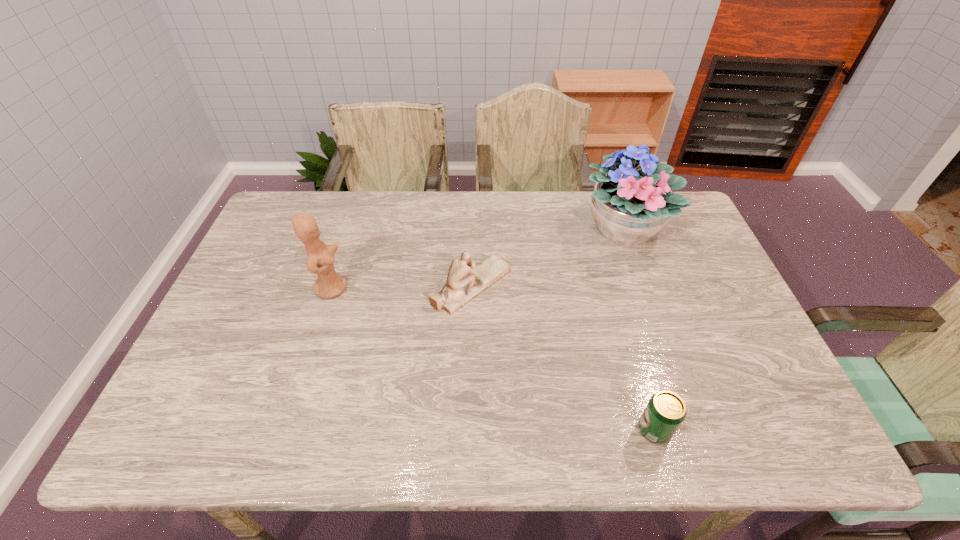
This screenshot has width=960, height=540. In order to click on bouquet in this screenshot , I will do `click(630, 206)`.

Identify the location of the leftmost object. (320, 260).

Identify the location of the left figurine. (320, 260).

Locate an element on the screen. the right figurine is located at coordinates (465, 281).

The width and height of the screenshot is (960, 540). Identify the location of the shorter figurine. (465, 281).

At what (x,y) coordinates should I click in order to perform the action: click on beer can. Please return your answer as a coordinate pair (x, y). Looking at the image, I should click on (665, 412).

You are a GUI agent. You are given a task and a screenshot of the screen. Output one action in this format:
    pyautogui.click(x=<x>, y=<y>)
    Task: Click on the nearest object
    This screenshot has width=960, height=540.
    Given the screenshot: What is the action you would take?
    pyautogui.click(x=665, y=412)

You are a GUI agent. You are given a task and a screenshot of the screen. Output one action in this format:
    pyautogui.click(x=<x>, y=<y>)
    Task: Click on the vacant region located on the front of the bouquet
    
    Given the screenshot: What is the action you would take?
    pyautogui.click(x=670, y=359)

Locate an element on the screen. vacant area located 0.310m on the front-facing side of the leftmost object is located at coordinates (457, 288).

Locate an element on the screen. vacant region located 0.190m on the front-facing side of the third tallest object is located at coordinates (578, 286).